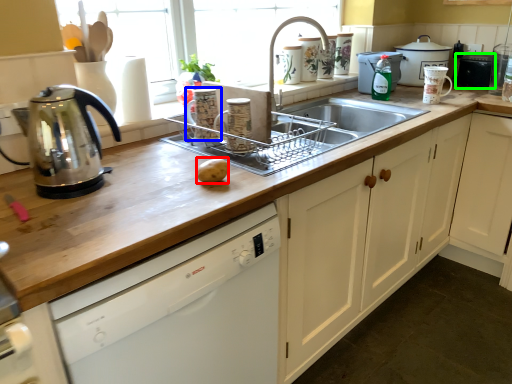
Question: Which object is the closest to the potato (highlighted by a red box)? Choose among these: appliance (highlighted by a blue box) or appliance (highlighted by a green box).

Choices:
 (A) appliance
 (B) appliance

Answer: (A)